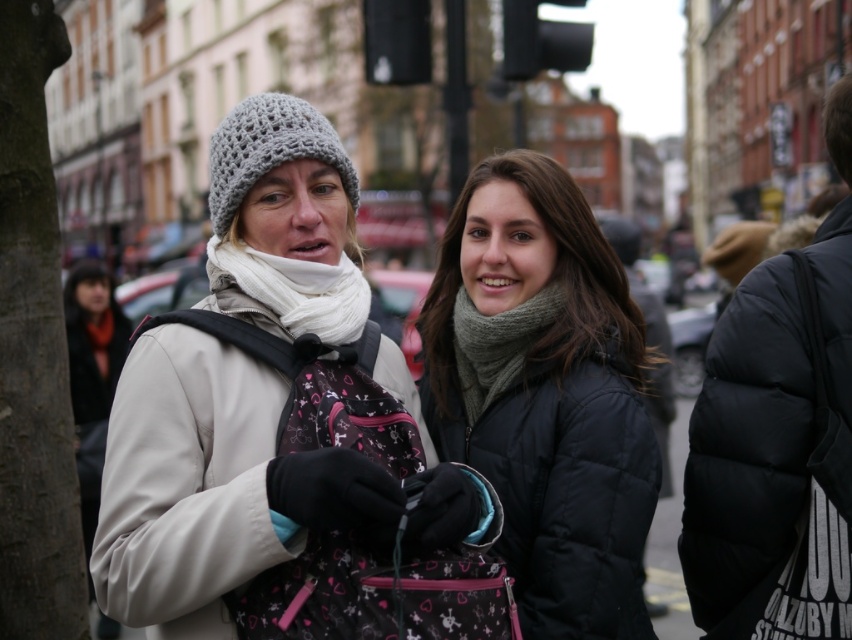
This screenshot has width=852, height=640. Describe the element at coordinates (550, 403) in the screenshot. I see `matte black jacket at center` at that location.

Can you confirm if matte black jacket at center is positioned above knitted gray scarf at center?

No.

Identify the location of matte black jacket at center. The height and width of the screenshot is (640, 852). (550, 403).

Does matte black jacket at center have a greater height compared to white soft scarf at center?

Yes, matte black jacket at center is taller than white soft scarf at center.

Does matte black jacket at center appear on the left side of white soft scarf at center?

Incorrect, matte black jacket at center is not on the left side of white soft scarf at center.

Which is behind, point (614, 464) or point (243, 246)?

The point (243, 246) is more distant.

Where is `matte black jacket at center`? matte black jacket at center is located at coordinates (550, 403).

Which is above, white matte jacket at center or matte black jacket at center?

white matte jacket at center

Image resolution: width=852 pixels, height=640 pixels. Identify the location of white matte jacket at center. (285, 429).

The width and height of the screenshot is (852, 640). I want to click on white matte jacket at center, so click(285, 429).